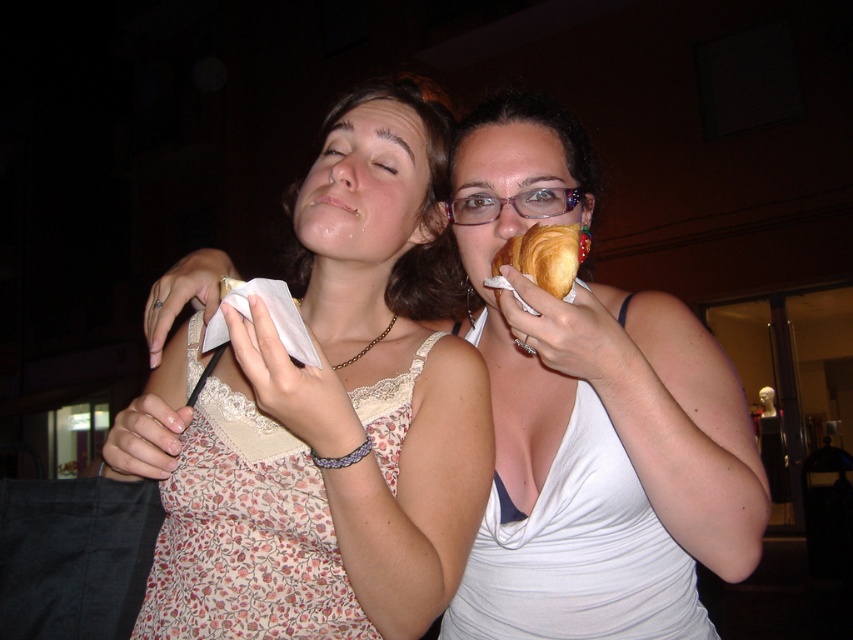
Question: Can you confirm if floral lace tank top at center is positioned to the left of golden croissant at upper right?

Choices:
 (A) yes
 (B) no

Answer: (A)

Question: Among these points, which one is nearest to the camera?

Choices:
 (A) (465, 588)
 (B) (543, 259)

Answer: (B)

Question: Which point is closer to the camera taking this photo?

Choices:
 (A) (575, 227)
 (B) (605, 403)

Answer: (B)

Question: Is floral lace tank top at center further to camera compared to golden croissant at upper right?

Choices:
 (A) yes
 (B) no

Answer: (B)

Question: Which point is closer to the camera taking this photo?

Choices:
 (A) (592, 468)
 (B) (492, 273)

Answer: (B)

Question: Is floral lace tank top at center positioned at the back of golden croissant at upper right?

Choices:
 (A) no
 (B) yes

Answer: (A)